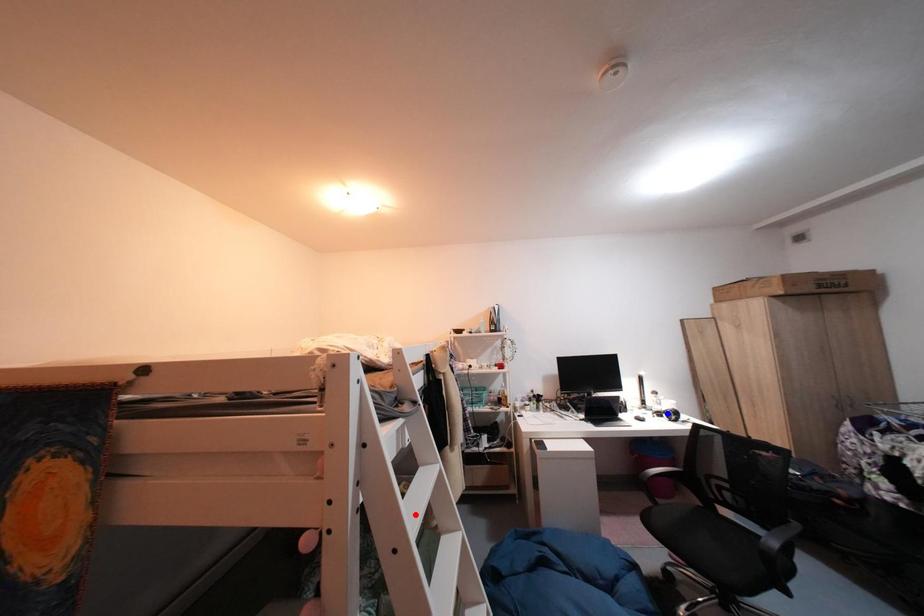
Question: In the image, two points are highlighted. Which point is nearer to the camera? Reply with the corresponding letter.

Choices:
 (A) blue point
 (B) red point

Answer: (B)